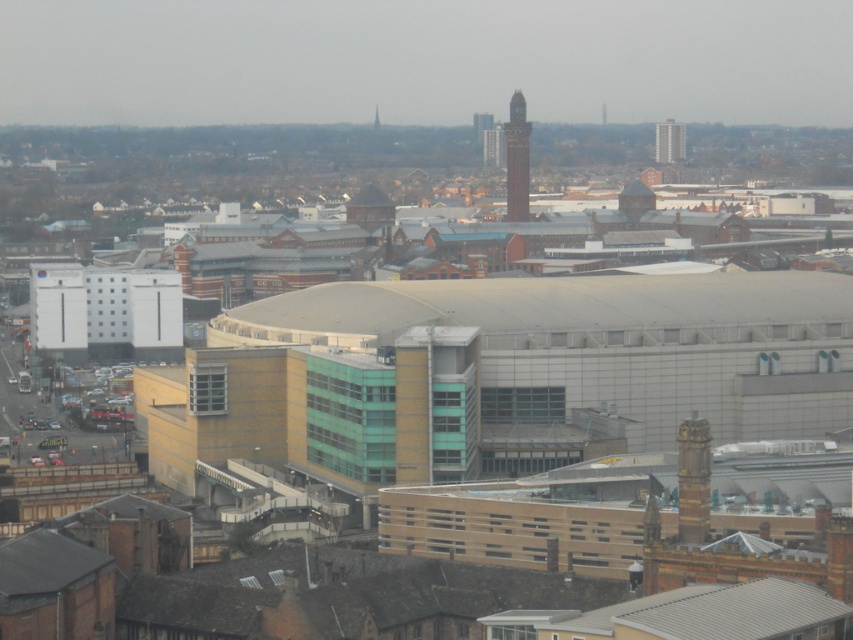
Between brown brick clock tower at upper center and brick tower at upper center, which one is positioned higher?

brick tower at upper center is above.

Which of these two, brown brick clock tower at upper center or brick tower at upper center, stands taller?

With more height is brown brick clock tower at upper center.

At what (x,y) coordinates should I click in order to perform the action: click on brown brick clock tower at upper center. Please return your answer as a coordinate pair (x, y). Looking at the image, I should click on (517, 160).

Locate an element on the screen. brown brick clock tower at upper center is located at coordinates (517, 160).

Is brown brick clock tower at upper center smaller than smooth glass skyscraper at upper right?

No.

Locate an element on the screen. The height and width of the screenshot is (640, 853). brown brick clock tower at upper center is located at coordinates tap(517, 160).

Does smooth glass skyscraper at upper right lie in front of brick tower at upper center?

No.

Can you confirm if smooth glass skyscraper at upper right is positioned to the left of brick tower at upper center?

Incorrect, smooth glass skyscraper at upper right is not on the left side of brick tower at upper center.

You are a GUI agent. You are given a task and a screenshot of the screen. Output one action in this format:
    pyautogui.click(x=<x>, y=<y>)
    Task: Click on the smooth glass skyscraper at upper right
    This screenshot has height=640, width=853.
    Given the screenshot: What is the action you would take?
    pyautogui.click(x=669, y=141)

You are a GUI agent. You are given a task and a screenshot of the screen. Output one action in this format:
    pyautogui.click(x=<x>, y=<y>)
    Task: Click on the smooth glass skyscraper at upper right
    The height and width of the screenshot is (640, 853).
    Given the screenshot: What is the action you would take?
    pyautogui.click(x=669, y=141)